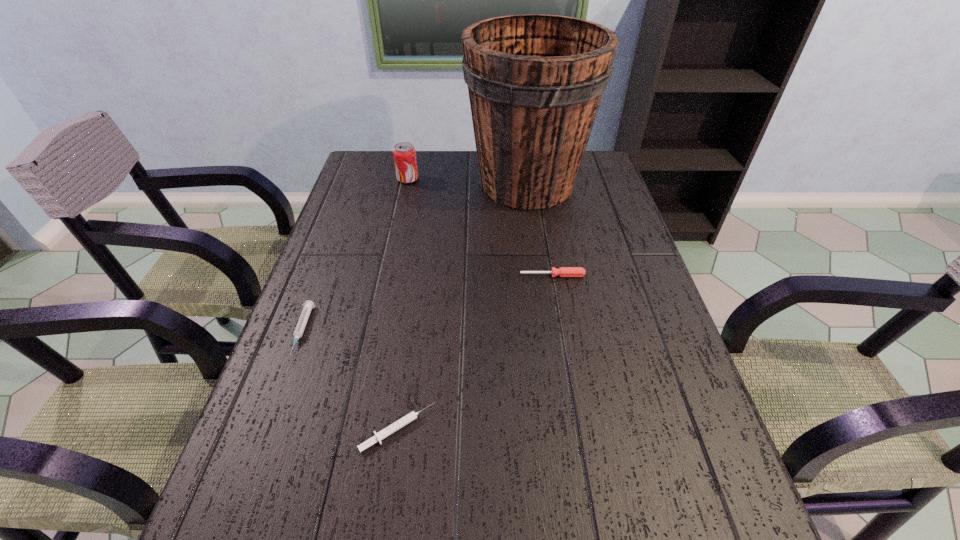
Where is `bucket`? bucket is located at coordinates (535, 82).

Locate an element on the screen. This screenshot has width=960, height=540. the fourth shortest object is located at coordinates (404, 153).

Identify the location of screwdriver. (562, 271).

What are the coordinates of `the taller syringe` in the screenshot? It's located at (308, 305).

Image resolution: width=960 pixels, height=540 pixels. I want to click on the leftmost object, so click(308, 305).

Locate an element on the screen. The image size is (960, 540). the shorter syringe is located at coordinates (405, 420).

Find the location of a particular element. the nearer syringe is located at coordinates click(405, 420).

Find the location of a particular element. The image size is (960, 540). free point located on the left of the bucket is located at coordinates (349, 184).

Find the location of a particular element. Image resolution: width=960 pixels, height=540 pixels. free space located 0.080m on the right of the second tallest object is located at coordinates (443, 179).

Locate an element on the screen. This screenshot has height=540, width=960. vacant region located 0.090m on the back of the screwdriver is located at coordinates click(x=548, y=250).